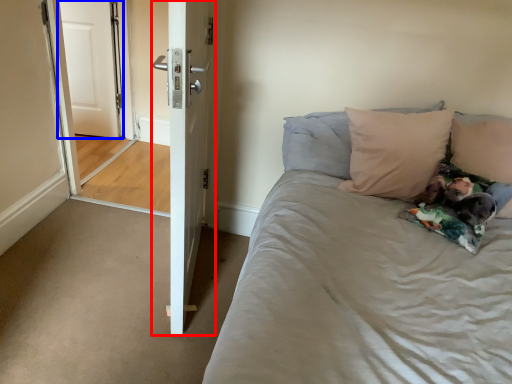
Question: Which point is further to the camera, door (highlighted by a red box) or door (highlighted by a blue box)?

Choices:
 (A) door
 (B) door

Answer: (B)